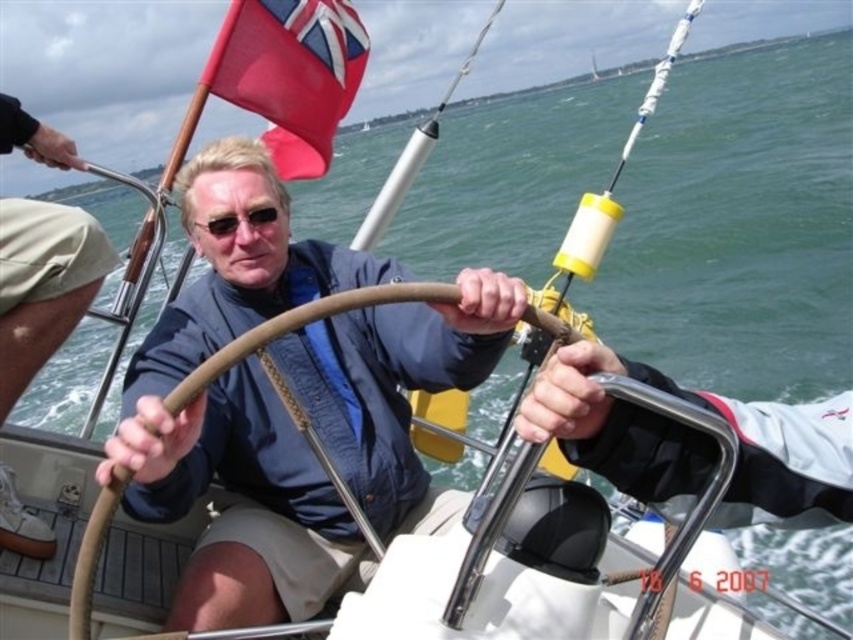
You are a passenger on the sailboat and want to know which item is nearer to you between the khaki shorts at center and the black plastic goggles at center. Based on the scene, which one is closer?

The khaki shorts at center is closer to the viewer than the black plastic goggles at center, so the khaki shorts at center is nearer.

You are a passenger on the sailboat and want to locate the khaki shorts at center and the black plastic goggles at center. According to the scene, which object is lower in position?

The khaki shorts at center is positioned under black plastic goggles at center, so the khaki shorts at center is lower than the black plastic goggles at center.

You are on a sailboat and need to locate the red fabric flag at upper left. According to the coordinates provided, where exactly is it positioned?

The red fabric flag at upper left is located at coordinates point (x=289, y=74).